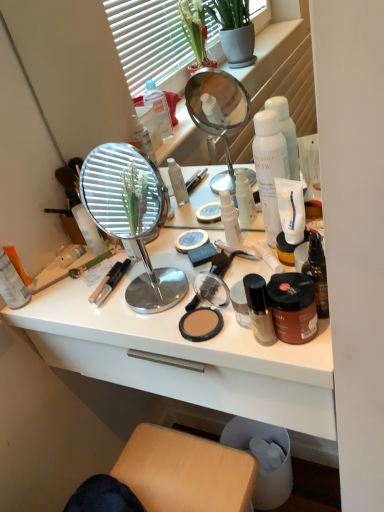
Image resolution: width=384 pixels, height=512 pixels. What are the coordinates of `empty space that is ontop of white glossy desk at center (from a real-world perspective)` in the screenshot? It's located at (169, 279).